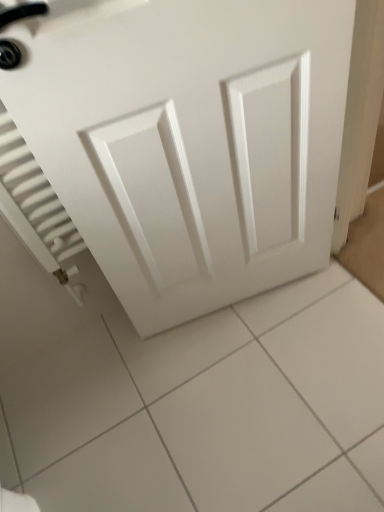
Describe the element at coordinates (208, 409) in the screenshot. Image resolution: width=384 pixels, height=512 pixels. I see `white ceramic tile at center` at that location.

Locate an element on the screen. This screenshot has height=512, width=384. white ceramic tile at center is located at coordinates (208, 409).

This screenshot has height=512, width=384. Identify the location of white ceramic tile at center. (208, 409).